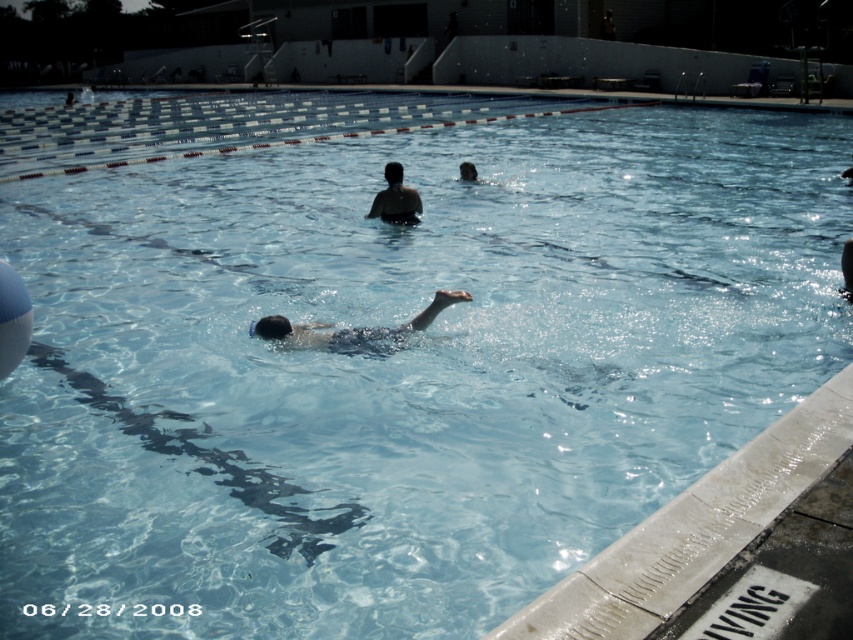
Is smooth skin swimmer at center to the left of dark brown hair at center from the viewer's perspective?

Correct, you'll find smooth skin swimmer at center to the left of dark brown hair at center.

Is the position of smooth skin swimmer at center more distant than that of dark brown hair at center?

No, it is in front of dark brown hair at center.

Which is behind, point (450, 301) or point (401, 218)?

The point (401, 218) is more distant.

Locate an element on the screen. Image resolution: width=853 pixels, height=640 pixels. smooth skin swimmer at center is located at coordinates (351, 330).